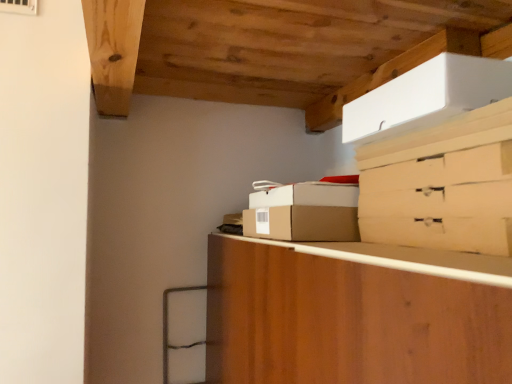
Question: Is white cardboard box at upper right, which is the third cardboard box in bottom-to-top order, aimed at brown cardboard box at center, placed as the 2th cardboard box when sorted from bottom to top?

Choices:
 (A) yes
 (B) no

Answer: (B)

Question: Considering the relative positions of white cardboard box at upper right, which is the third cardboard box in bottom-to-top order, and brown cardboard box at center, which appears as the second cardboard box when viewed from the top, in the image provided, is white cardboard box at upper right, which is the third cardboard box in bottom-to-top order, to the right of brown cardboard box at center, which appears as the second cardboard box when viewed from the top, from the viewer's perspective?

Choices:
 (A) no
 (B) yes

Answer: (B)

Question: Does white cardboard box at upper right, which is the third cardboard box in bottom-to-top order, appear on the left side of brown cardboard box at center, which appears as the second cardboard box when viewed from the top?

Choices:
 (A) no
 (B) yes

Answer: (A)

Question: Is brown cardboard box at center, which appears as the second cardboard box when viewed from the top, located within white cardboard box at upper right, which is the third cardboard box in bottom-to-top order?

Choices:
 (A) yes
 (B) no

Answer: (B)

Question: Can you confirm if white cardboard box at upper right, which is the third cardboard box in bottom-to-top order, is smaller than brown cardboard box at center, placed as the 2th cardboard box when sorted from bottom to top?

Choices:
 (A) no
 (B) yes

Answer: (A)

Question: In terms of height, does brown cardboard box at center, placed as the 2th cardboard box when sorted from bottom to top, look taller or shorter compared to matte cardboard drawer at upper right?

Choices:
 (A) tall
 (B) short

Answer: (A)

Question: Looking at their shapes, would you say brown cardboard box at center, placed as the 2th cardboard box when sorted from bottom to top, is wider or thinner than matte cardboard drawer at upper right?

Choices:
 (A) thin
 (B) wide

Answer: (A)

Question: From the image's perspective, is brown cardboard box at center, which appears as the second cardboard box when viewed from the top, located above or below matte cardboard drawer at upper right?

Choices:
 (A) below
 (B) above

Answer: (B)

Question: From a real-world perspective, relative to matte cardboard drawer at upper right, is brown cardboard box at center, placed as the 2th cardboard box when sorted from bottom to top, vertically above or below?

Choices:
 (A) above
 (B) below

Answer: (A)

Question: In terms of width, does white cardboard box at upper right, which is the third cardboard box in bottom-to-top order, look wider or thinner when compared to brown cardboard box at center, placed as the 2th cardboard box when sorted from bottom to top?

Choices:
 (A) wide
 (B) thin

Answer: (A)

Question: In terms of size, does white cardboard box at upper right, which is the third cardboard box in bottom-to-top order, appear bigger or smaller than brown cardboard box at center, placed as the 2th cardboard box when sorted from bottom to top?

Choices:
 (A) big
 (B) small

Answer: (A)

Question: From a real-world perspective, is white cardboard box at upper right, which is the third cardboard box in bottom-to-top order, positioned above or below brown cardboard box at center, placed as the 2th cardboard box when sorted from bottom to top?

Choices:
 (A) above
 (B) below

Answer: (A)

Question: Considering the positions of white cardboard box at upper right, which is the third cardboard box in bottom-to-top order, and brown cardboard box at center, placed as the 2th cardboard box when sorted from bottom to top, in the image, is white cardboard box at upper right, which is the third cardboard box in bottom-to-top order, taller or shorter than brown cardboard box at center, placed as the 2th cardboard box when sorted from bottom to top,?

Choices:
 (A) tall
 (B) short

Answer: (A)

Question: From their relative heights in the image, would you say wooden cabinet at center is taller or shorter than brown cardboard box at center, which appears as the second cardboard box when viewed from the top?

Choices:
 (A) tall
 (B) short

Answer: (A)

Question: Is wooden cabinet at center in front of or behind brown cardboard box at center, which appears as the second cardboard box when viewed from the top, in the image?

Choices:
 (A) behind
 (B) front

Answer: (B)